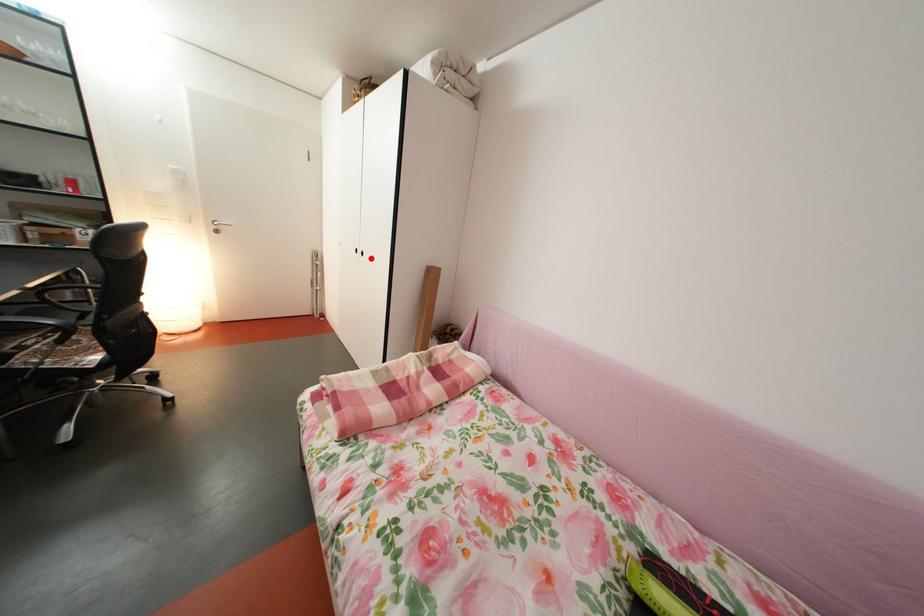
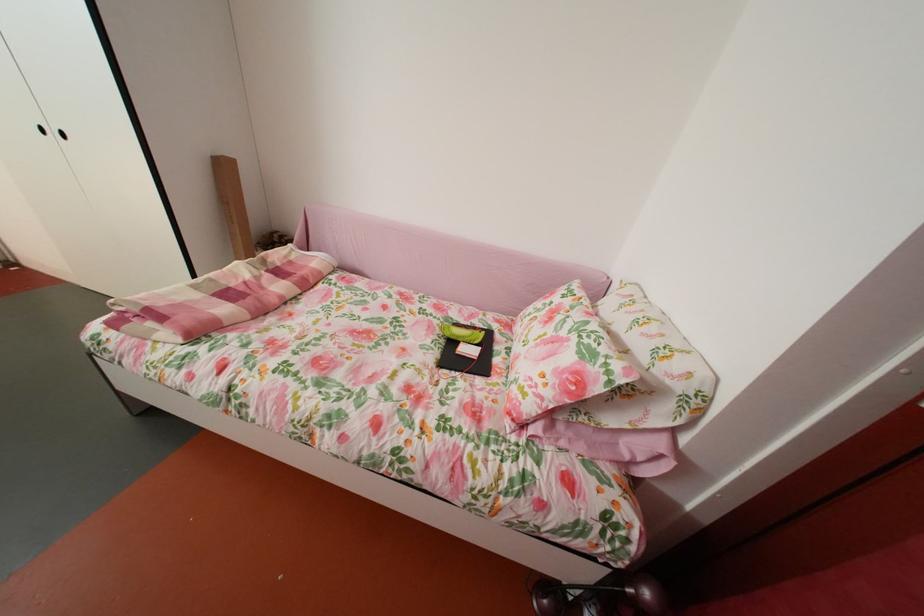
Question: I am providing you with two images of the same scene from different viewpoints. A red point is shown in image1. For the corresponding object point in image2, is it positioned nearer or farther from the camera?

Choices:
 (A) Nearer
 (B) Farther

Answer: (A)